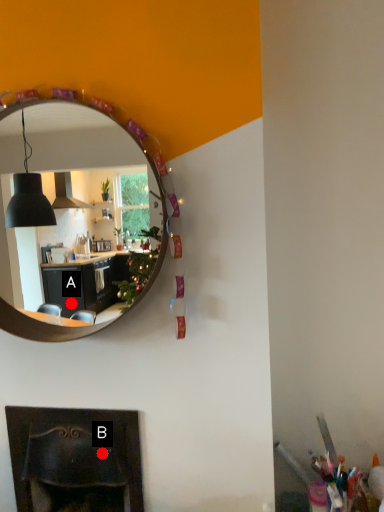
Question: Two points are circled on the image, labeled by A and B beside each circle. Which point appears closest to the camera in this image?

Choices:
 (A) A is closer
 (B) B is closer

Answer: (B)